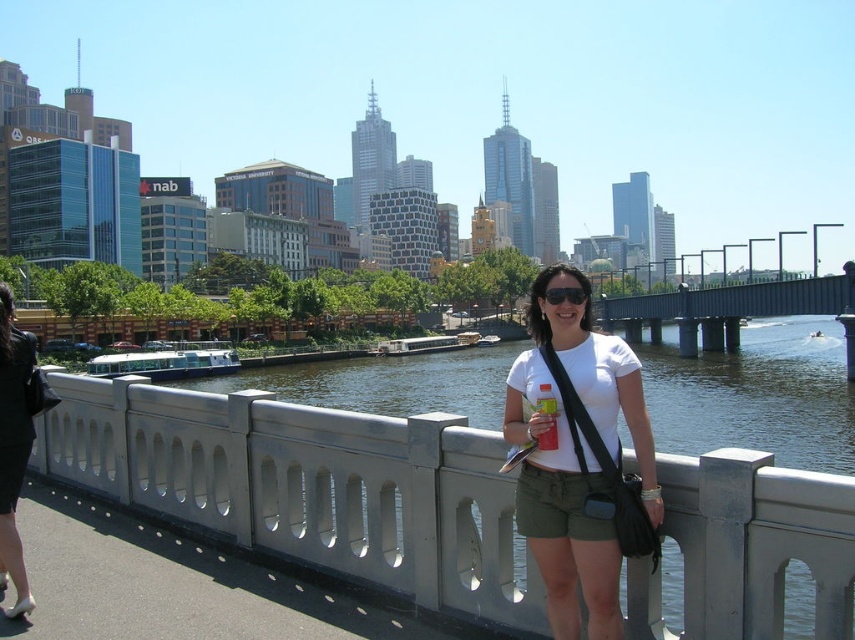
You are a photographer positioned on the bridge and want to capture both the gray concrete railing at center and the black leather jacket at left in the same frame. Based on their positions, which object should you adjust your camera to focus on first to ensure both are in the shot?

Since the gray concrete railing at center is to the right of the black leather jacket at left, you should focus on the black leather jacket at left first to ensure both are included in the frame.

Based on the photo, you are standing on the gray concrete bridge at center and want to take a photo of the gray concrete railing at center. In which direction should you point your camera to capture the railing?

You should point your camera to the left because the gray concrete railing at center is to the left of the gray concrete bridge at center.